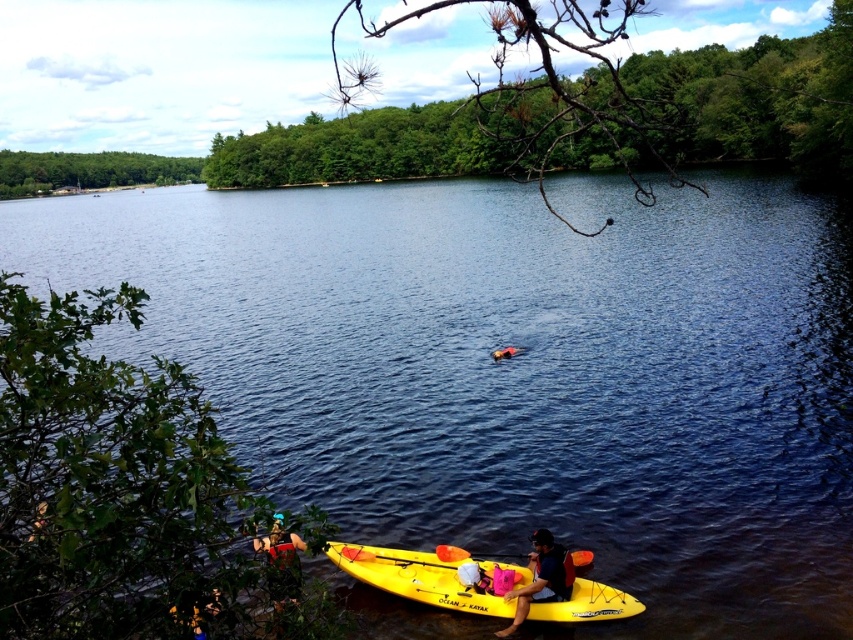
Question: Can you confirm if blue water at center is positioned to the right of yellow plastic paddle at lower center?

Choices:
 (A) no
 (B) yes

Answer: (A)

Question: Is blue water at center further to camera compared to yellow matte kayak at lower center?

Choices:
 (A) no
 (B) yes

Answer: (A)

Question: Which object appears farthest from the camera in this image?

Choices:
 (A) yellow matte kayak at lower center
 (B) yellow plastic paddle at lower center
 (C) yellow plastic kayak at lower center

Answer: (B)

Question: Which point is farther to the camera?

Choices:
 (A) green fabric shirt at lower left
 (B) blue water at center

Answer: (B)

Question: Does blue water at center appear under yellow plastic kayak at lower center?

Choices:
 (A) yes
 (B) no

Answer: (B)

Question: Which point is farther from the camera taking this photo?

Choices:
 (A) (114, 278)
 (B) (292, 589)
 (C) (409, 552)
 (D) (537, 540)

Answer: (A)